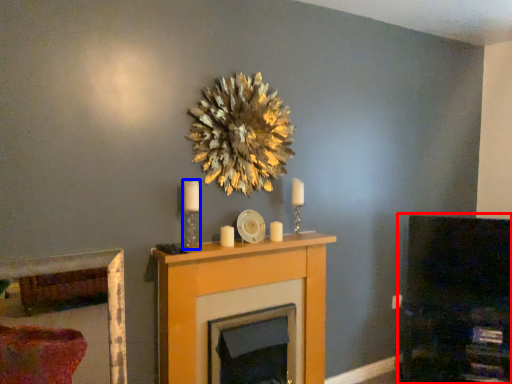
Question: Which point is closer to the camera, dark (highlighted by a red box) or candle holder (highlighted by a blue box)?

Choices:
 (A) dark
 (B) candle holder

Answer: (B)